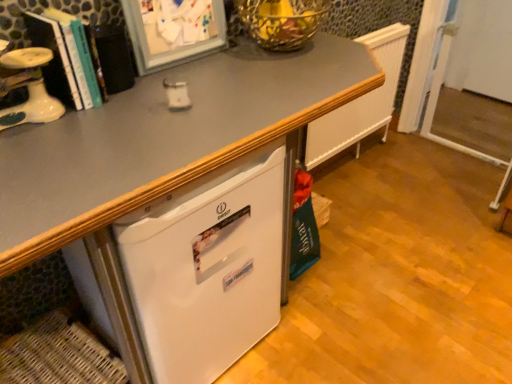
Question: Is white matte refrigerator at lower left wider or thinner than hardcover book at left?

Choices:
 (A) thin
 (B) wide

Answer: (B)

Question: From the image's perspective, is white matte refrigerator at lower left positioned above or below hardcover book at left?

Choices:
 (A) above
 (B) below

Answer: (B)

Question: Which of these objects is positioned farthest from the white matte refrigerator at lower left?

Choices:
 (A) white glossy desk at center
 (B) white plastic screen door at right
 (C) hardcover book at left
 (D) white textured radiator at upper right
 (E) woven brown basket at lower left

Answer: (B)

Question: Which is farther from the white glossy desk at center?

Choices:
 (A) hardcover book at left
 (B) woven brown basket at lower left
 (C) white textured radiator at upper right
 (D) white matte refrigerator at lower left
 (E) white plastic screen door at right

Answer: (E)